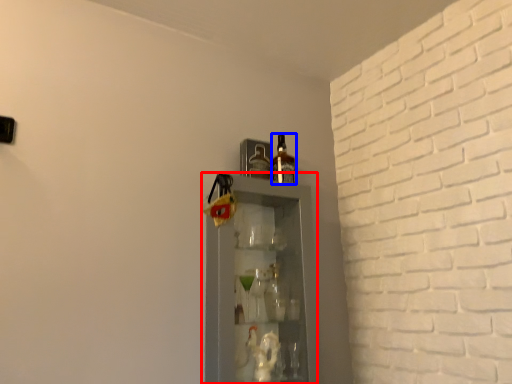
Question: Which of the following is the farthest to the observer, shelf (highlighted by a red box) or bottle (highlighted by a blue box)?

Choices:
 (A) shelf
 (B) bottle

Answer: (B)